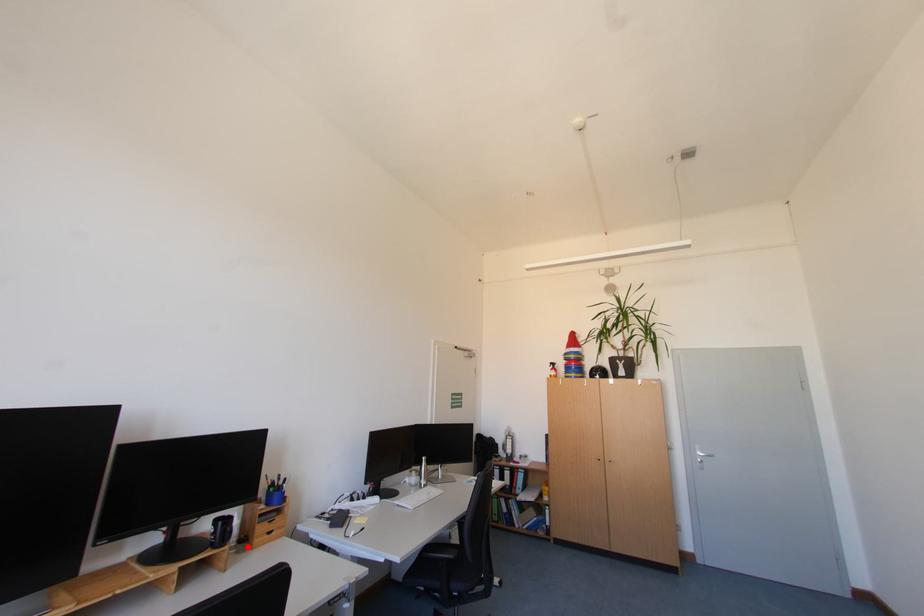
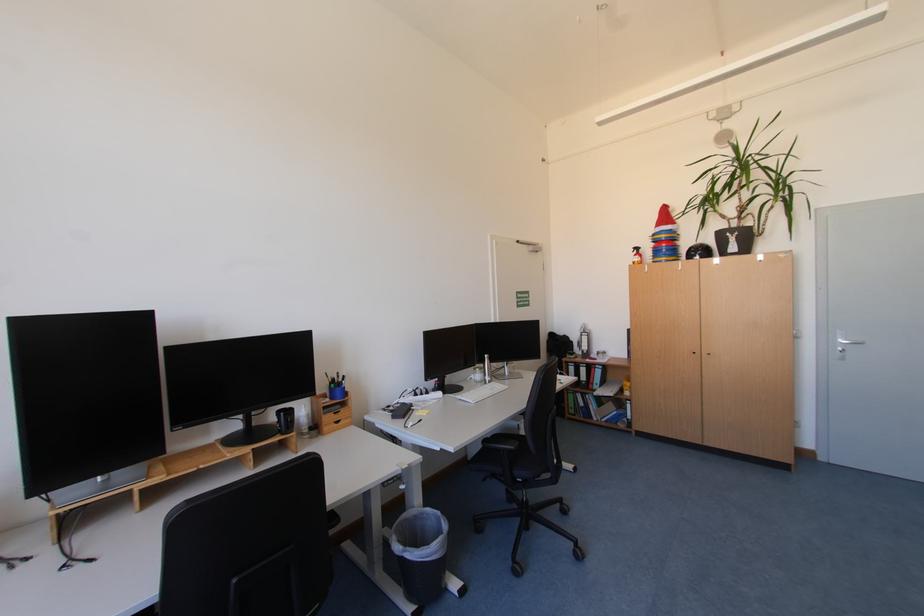
The point at the highlighted location is marked in the first image. Where is the corresponding point in the second image?

(321, 432)